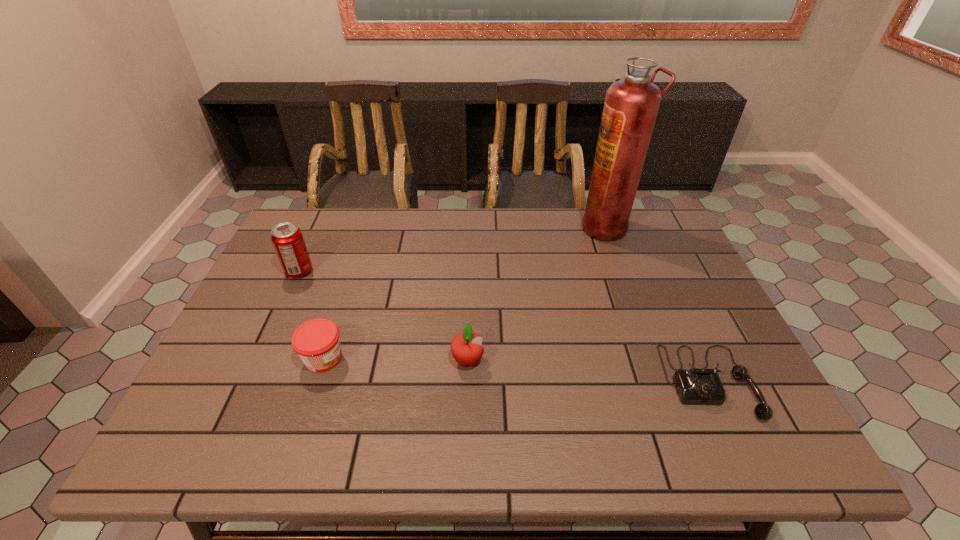
What are the coordinates of `vacant space positioned on the front of the second tallest object` in the screenshot? It's located at (241, 397).

Identify the location of free region located 0.100m on the front of the apple. The width and height of the screenshot is (960, 540). (467, 413).

Where is `vacant space positioned 0.310m on the label side of the jam`? The height and width of the screenshot is (540, 960). vacant space positioned 0.310m on the label side of the jam is located at coordinates (476, 358).

This screenshot has height=540, width=960. In order to click on object positioned at the far edge in this screenshot , I will do tap(631, 105).

This screenshot has height=540, width=960. Find the location of `object that is at the near edge`. object that is at the near edge is located at coordinates (703, 386).

Locate an element on the screen. object positioned at the left edge is located at coordinates (287, 238).

Find the location of a particular element. fire extinguisher located at the right edge is located at coordinates (631, 105).

Where is `telephone that is at the right edge`? This screenshot has height=540, width=960. telephone that is at the right edge is located at coordinates (703, 386).

Locate an element on the screen. object situated at the far right corner is located at coordinates (631, 105).

Locate an element on the screen. object that is at the near right corner is located at coordinates (703, 386).